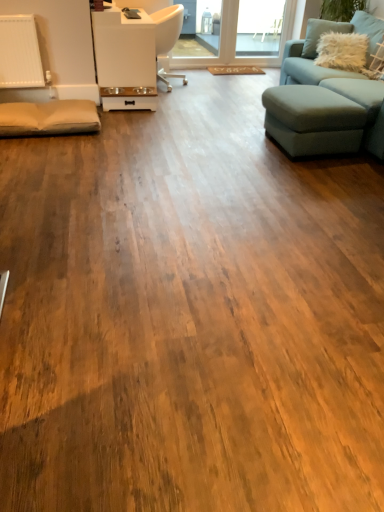
Question: Could white glossy pet feeder at upper center be considered to be inside white fluffy pillow at upper right?

Choices:
 (A) no
 (B) yes

Answer: (A)

Question: Is white fluffy pillow at upper right outside of white glossy pet feeder at upper center?

Choices:
 (A) yes
 (B) no

Answer: (A)

Question: Is white fluffy pillow at upper right to the right of white glossy pet feeder at upper center from the viewer's perspective?

Choices:
 (A) no
 (B) yes

Answer: (B)

Question: From a real-world perspective, is white fluffy pillow at upper right over white glossy pet feeder at upper center?

Choices:
 (A) yes
 (B) no

Answer: (A)

Question: Does white fluffy pillow at upper right have a greater height compared to white glossy pet feeder at upper center?

Choices:
 (A) no
 (B) yes

Answer: (A)

Question: Does point (160, 35) appear closer or farther from the camera than point (326, 117)?

Choices:
 (A) closer
 (B) farther

Answer: (B)

Question: Looking at their shapes, would you say white glossy chair at upper center is wider or thinner than teal fabric studio couch at right?

Choices:
 (A) thin
 (B) wide

Answer: (A)

Question: From a real-world perspective, is white glossy chair at upper center physically located above or below teal fabric studio couch at right?

Choices:
 (A) below
 (B) above

Answer: (A)

Question: From their relative heights in the image, would you say white glossy chair at upper center is taller or shorter than teal fabric studio couch at right?

Choices:
 (A) tall
 (B) short

Answer: (B)

Question: In the image, is white glossy pet feeder at upper center on the left side or the right side of teal fabric studio couch at right?

Choices:
 (A) right
 (B) left

Answer: (B)

Question: Is white glossy pet feeder at upper center in front of or behind teal fabric studio couch at right in the image?

Choices:
 (A) front
 (B) behind

Answer: (B)

Question: Considering the positions of point (114, 12) and point (292, 80), is point (114, 12) closer or farther from the camera than point (292, 80)?

Choices:
 (A) farther
 (B) closer

Answer: (B)

Question: From the image's perspective, is white glossy pet feeder at upper center positioned above or below teal fabric studio couch at right?

Choices:
 (A) above
 (B) below

Answer: (A)

Question: Considering the positions of point (238, 44) and point (311, 143), is point (238, 44) closer or farther from the camera than point (311, 143)?

Choices:
 (A) farther
 (B) closer

Answer: (A)

Question: In terms of height, does transparent glass window at upper center look taller or shorter compared to light blue fabric footrest at right?

Choices:
 (A) short
 (B) tall

Answer: (B)